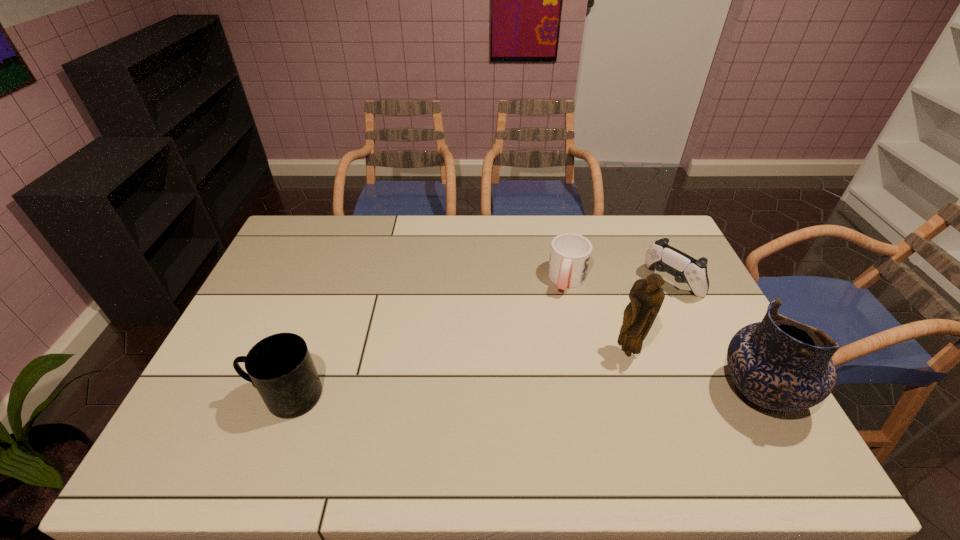
Find the location of a particular element. Image resolution: width=960 pixels, height=540 pixels. mug located at the near edge is located at coordinates (280, 366).

You are a GUI agent. You are given a task and a screenshot of the screen. Output one action in this format:
    pyautogui.click(x=<x>, y=<y>)
    Task: Click on the pottery that is at the near edge
    The width and height of the screenshot is (960, 540).
    Given the screenshot: What is the action you would take?
    779,364

Image resolution: width=960 pixels, height=540 pixels. In order to click on object present at the left edge in this screenshot , I will do `click(280, 366)`.

I want to click on pottery at the right edge, so click(x=779, y=364).

You are a GUI agent. You are given a task and a screenshot of the screen. Output one action in this format:
    pyautogui.click(x=<x>, y=<y>)
    Task: Click on the control located in the right edge section of the desktop
    
    Given the screenshot: What is the action you would take?
    pyautogui.click(x=664, y=258)

Where is `object situated at the near left corner`? The image size is (960, 540). object situated at the near left corner is located at coordinates (280, 366).

You are a GUI agent. You are given a task and a screenshot of the screen. Output one action in this format:
    pyautogui.click(x=<x>, y=<y>)
    Task: Click on the object that is at the near right corner
    This screenshot has height=540, width=960.
    Given the screenshot: What is the action you would take?
    pyautogui.click(x=779, y=364)

Where is `free space at the far edge of the desktop`? The height and width of the screenshot is (540, 960). free space at the far edge of the desktop is located at coordinates (463, 246).

Where is `free space at the near edge of the desktop`? The image size is (960, 540). free space at the near edge of the desktop is located at coordinates (484, 397).

You are a GUI agent. You are given a task and a screenshot of the screen. Output one action in this format:
    pyautogui.click(x=<x>, y=<y>)
    Task: Click on the vacant space at the left edge of the desktop
    This screenshot has width=960, height=540.
    Given the screenshot: What is the action you would take?
    [292, 268]